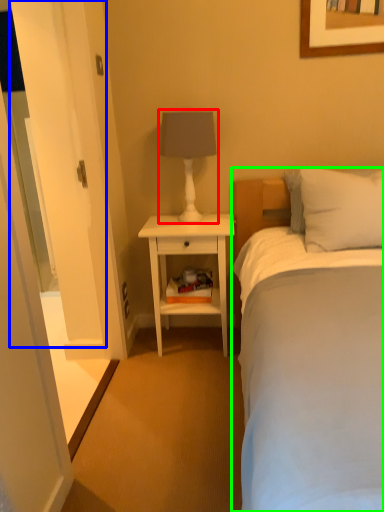
Question: Which object is the farthest from table lamp (highlighted by a red box)? Choose among these: glass door (highlighted by a blue box) or bed (highlighted by a green box).

Choices:
 (A) glass door
 (B) bed

Answer: (B)